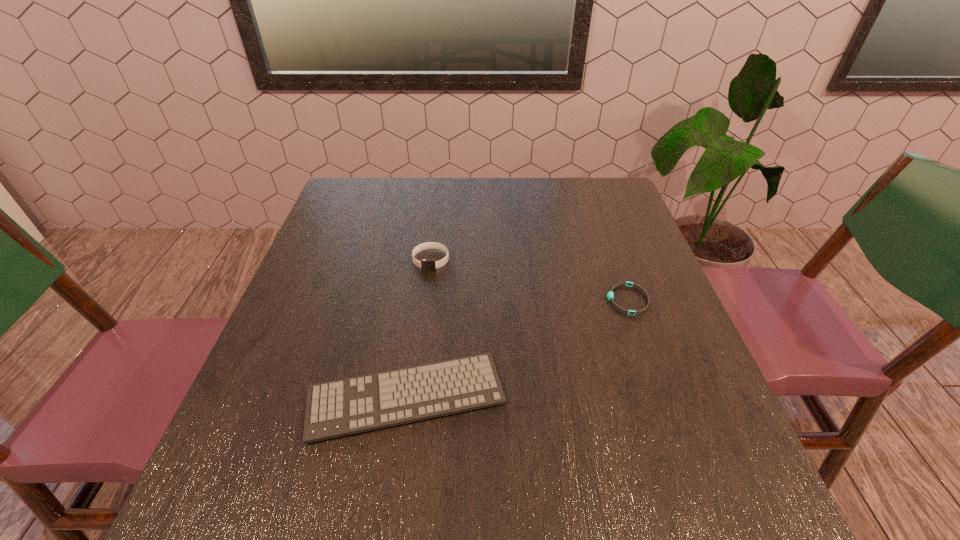
At what (x,y) coordinates should I click in order to perform the action: click on vacant space situated 0.120m on the buckle of the second farthest object. Please return your answer as a coordinate pair (x, y). This screenshot has width=960, height=540. Looking at the image, I should click on (555, 300).

Where is `object present at the left edge`? This screenshot has width=960, height=540. object present at the left edge is located at coordinates (343, 407).

The image size is (960, 540). I want to click on object present at the right edge, so click(610, 296).

Locate an element on the screen. The image size is (960, 540). free spot at the far edge of the desktop is located at coordinates (565, 183).

The image size is (960, 540). What are the coordinates of `vacant space at the near edge of the desktop` in the screenshot? It's located at (420, 502).

Image resolution: width=960 pixels, height=540 pixels. In order to click on vacant area at the left edge in this screenshot , I will do `click(332, 353)`.

In the image, there is a desktop. Identify the location of free space at the right edge. Image resolution: width=960 pixels, height=540 pixels. (586, 232).

Find the location of a particular element. The width and height of the screenshot is (960, 540). vacant space at the far left corner is located at coordinates pos(390,190).

In the image, there is a desktop. At what (x,y) coordinates should I click in order to perform the action: click on vacant area at the near right corner. Please return your answer as a coordinate pair (x, y). Looking at the image, I should click on (691, 501).

The width and height of the screenshot is (960, 540). In order to click on unoccupied area between the second shortest object and the nearer wristband in this screenshot , I will do `click(516, 348)`.